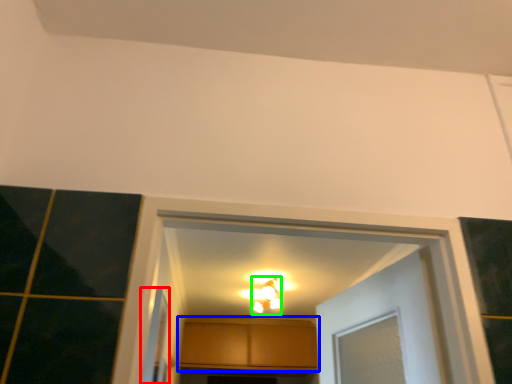
Question: Based on their relative distances, which object is farther from screen door (highlighted by a red box)? Choose from cabinetry (highlighted by a blue box) and light fixture (highlighted by a green box).

Choices:
 (A) cabinetry
 (B) light fixture

Answer: (A)